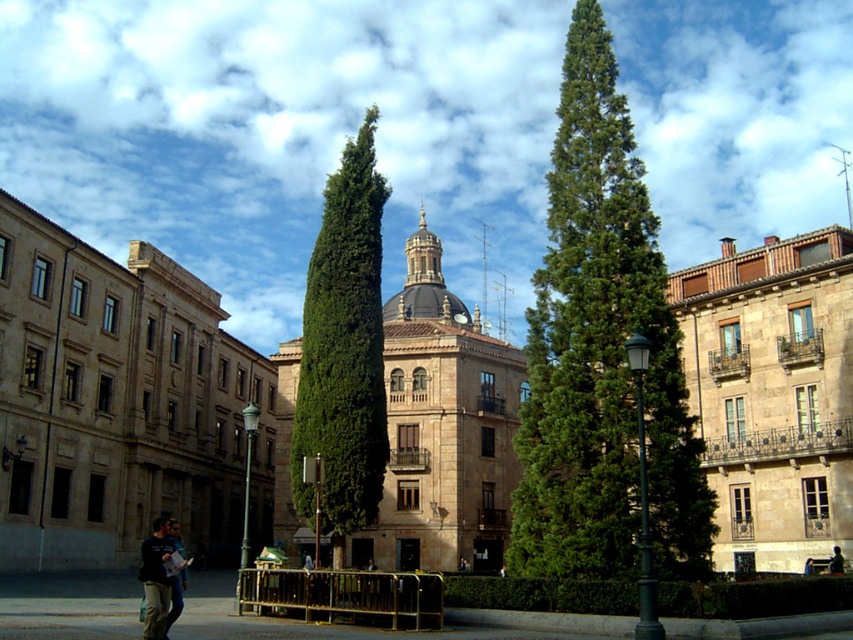
Does green coniferous tree at center appear under silhouette figure at center?

Incorrect, green coniferous tree at center is not positioned below silhouette figure at center.

How much distance is there between green coniferous tree at center and silhouette figure at center?

green coniferous tree at center and silhouette figure at center are 59.04 feet apart.

Does point (544, 259) lie behind point (840, 568)?

Yes.

Where is `green coniferous tree at center`? This screenshot has height=640, width=853. green coniferous tree at center is located at coordinates (602, 355).

Locate an element on the screen. Image resolution: width=853 pixels, height=640 pixels. green leafy tree at center is located at coordinates (343, 353).

Which is behind, point (355, 358) or point (815, 570)?

The point (355, 358) is more distant.

Is point (338, 337) less distant than point (811, 563)?

No, (338, 337) is behind (811, 563).

Find the location of a particular element. green leafy tree at center is located at coordinates (343, 353).

Is green coniferous tree at center in front of blue fabric bag at center?

Yes, green coniferous tree at center is in front of blue fabric bag at center.

Who is shorter, green coniferous tree at center or blue fabric bag at center?

With less height is blue fabric bag at center.

Who is more distant from viewer, (x=529, y=506) or (x=811, y=563)?

The point (x=811, y=563) is more distant.

Where is `green coniferous tree at center`? This screenshot has height=640, width=853. green coniferous tree at center is located at coordinates (602, 355).